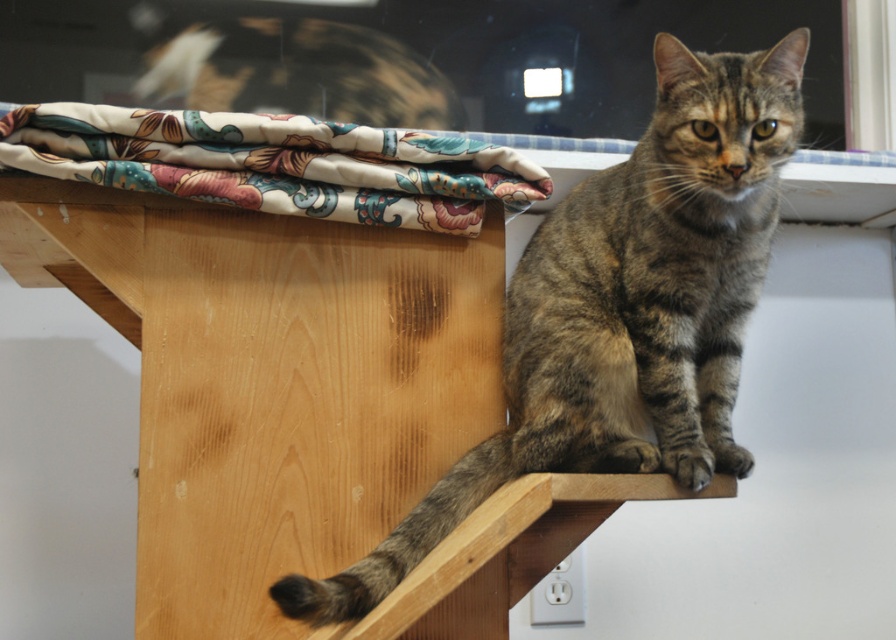
Consider the image. You are an interior designer assessing the space in the image. You need to determine if the tabby fur cat at center and the floral fabric at upper left can be placed side by side without overlapping. Based on their widths, what is your conclusion?

The tabby fur cat at center has a lesser width compared to floral fabric at upper left, so they can be placed side by side without overlapping as there is sufficient space between them.